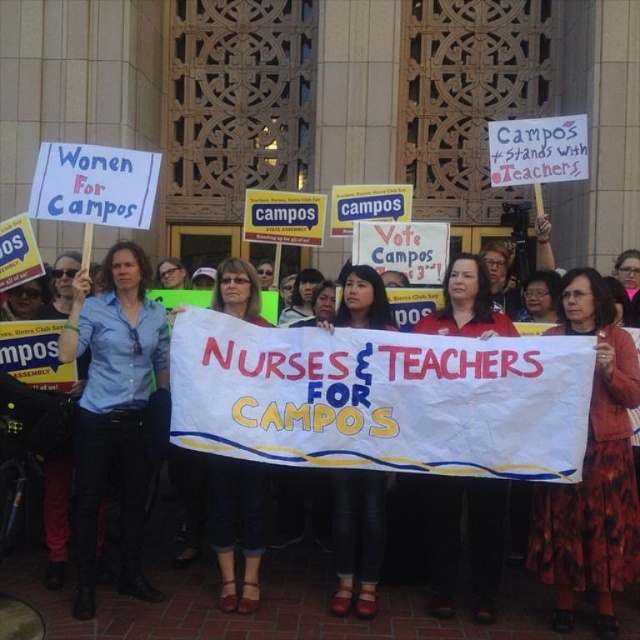
Question: Is floral dress at center below denim jeans at center?

Choices:
 (A) yes
 (B) no

Answer: (A)

Question: Does floral dress at center have a greater width compared to denim pants at center?

Choices:
 (A) no
 (B) yes

Answer: (A)

Question: Among these objects, which one is farthest from the camera?

Choices:
 (A) blue shirt at center
 (B) matte red shirt at center
 (C) floral dress at center
 (D) denim jeans at center

Answer: (D)

Question: Considering the relative positions of matte red shirt at center and denim jeans at center in the image provided, where is matte red shirt at center located with respect to denim jeans at center?

Choices:
 (A) above
 (B) below

Answer: (B)

Question: Among these objects, which one is farthest from the camera?

Choices:
 (A) floral dress at center
 (B) denim pants at center
 (C) blue shirt at center
 (D) matte black hair at center

Answer: (D)

Question: Which object appears farthest from the camera in this image?

Choices:
 (A) denim jeans at center
 (B) blue shirt at center
 (C) denim pants at center

Answer: (C)